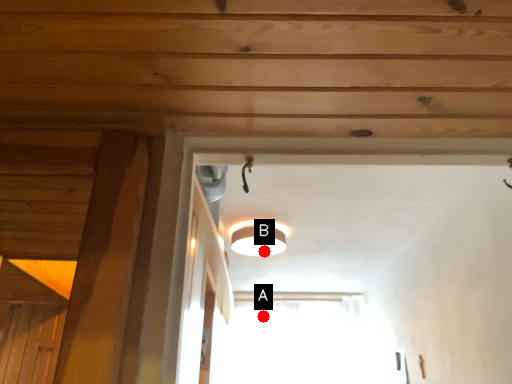
Question: Two points are circled on the image, labeled by A and B beside each circle. Among these points, which one is farthest from the camera?

Choices:
 (A) A is further
 (B) B is further

Answer: (A)